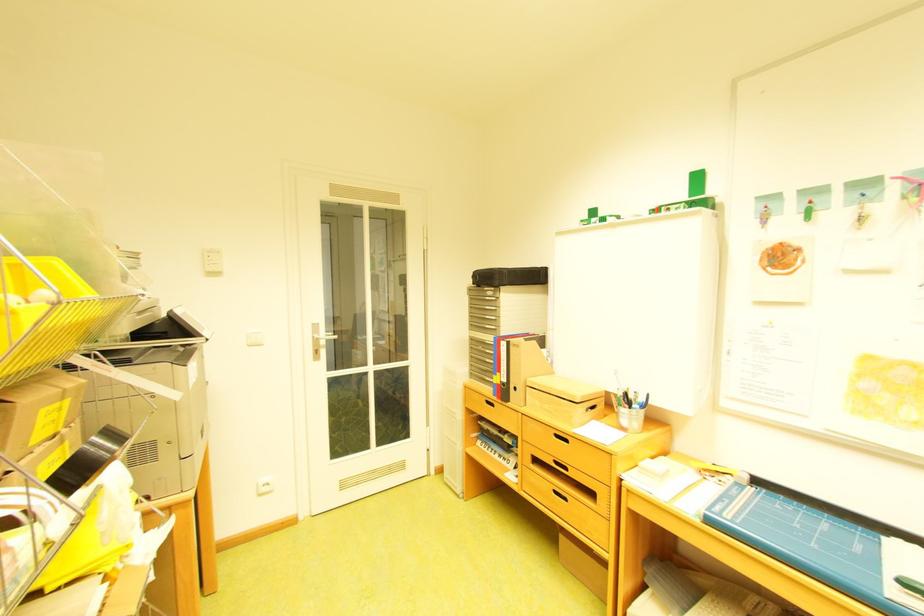
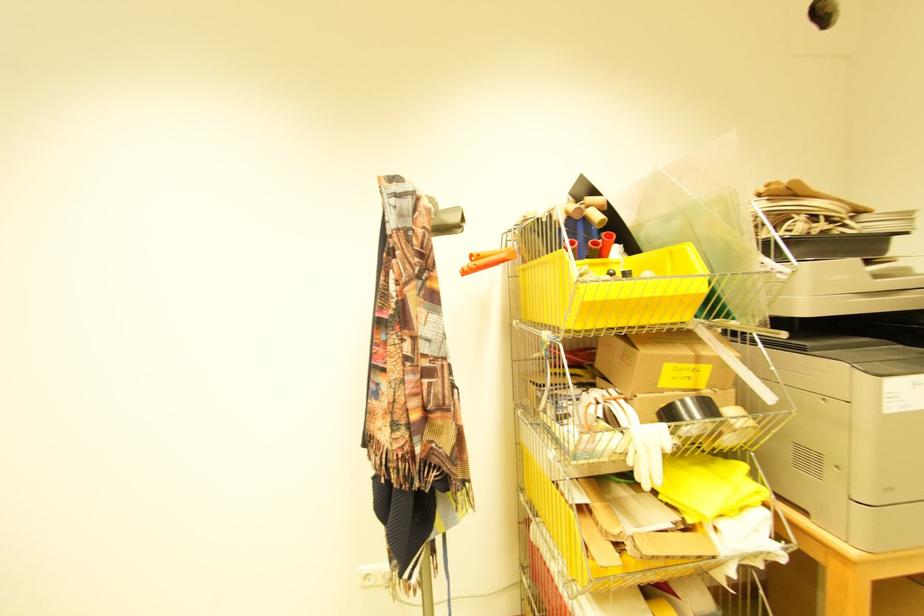
Question: The camera is either moving clockwise (left) or counter-clockwise (right) around the object. The first image is from the beginning of the video and the second image is from the end. Is the camera moving left or right when shooting the video?

Choices:
 (A) Left
 (B) Right

Answer: (B)